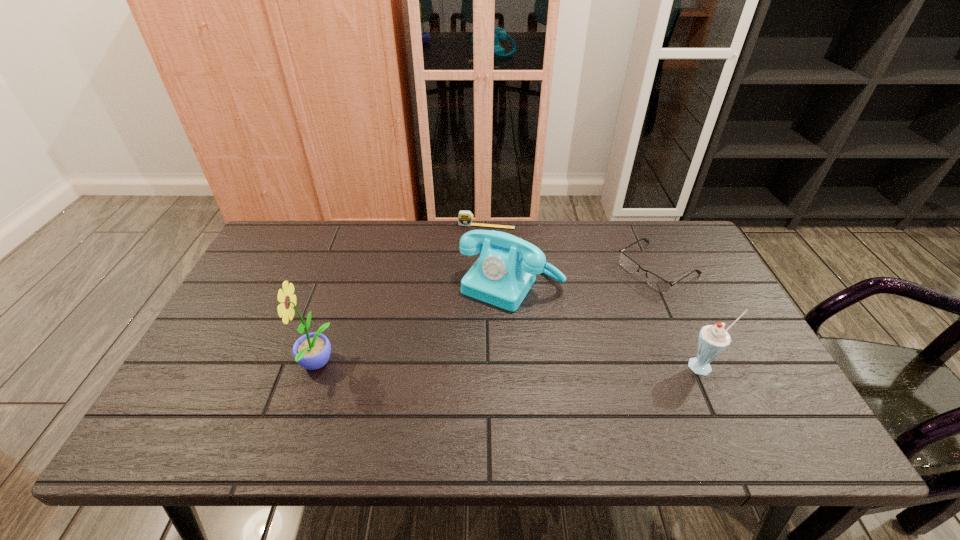
Locate an element on the screen. vacant space on the desktop that is between the sunflower and the milkshake and is positioned on the dial of the telephone is located at coordinates (458, 366).

Locate an element on the screen. The width and height of the screenshot is (960, 540). vacant space on the desktop that is between the tallest object and the milkshake and is positioned on the front-facing side of the spectacles is located at coordinates (500, 366).

This screenshot has height=540, width=960. Find the location of `free space on the desktop that is between the sunflower and the milkshake and is positioned at the front of the farthest object with the tape extended`. free space on the desktop that is between the sunflower and the milkshake and is positioned at the front of the farthest object with the tape extended is located at coordinates (457, 366).